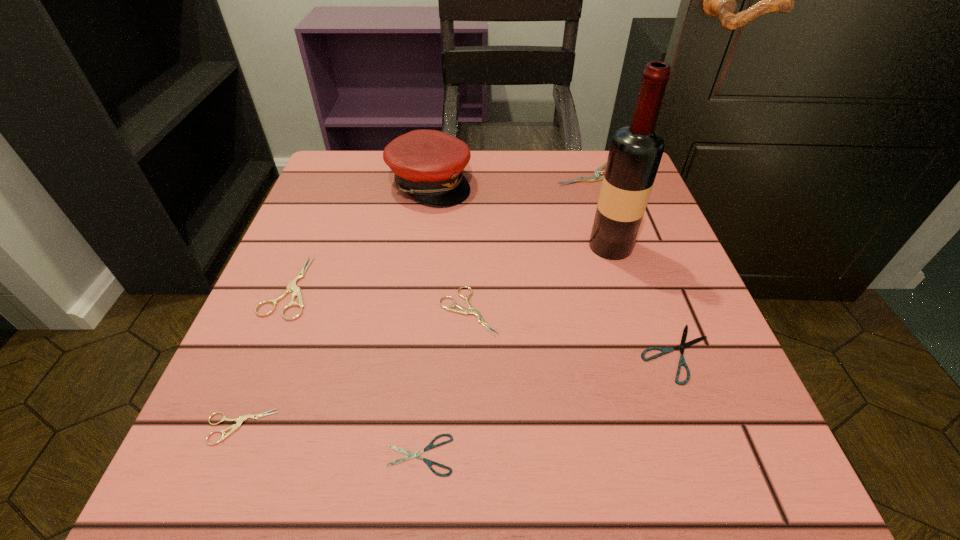
Locate an element on the screen. The width and height of the screenshot is (960, 540). the bigger black shears is located at coordinates (683, 345).

Locate an element on the screen. the farther black shears is located at coordinates (683, 345).

Identify the location of the nearer black shears. The height and width of the screenshot is (540, 960). (410, 454).

You are a GUI agent. You are given a task and a screenshot of the screen. Output one action in this format:
    pyautogui.click(x=<x>, y=<y>)
    Task: Click on the shortest object
    The height and width of the screenshot is (540, 960).
    Given the screenshot: What is the action you would take?
    pyautogui.click(x=410, y=454)

You are a GUI agent. You are given a task and a screenshot of the screen. Output one action in this format:
    pyautogui.click(x=<x>, y=<y>)
    Task: Click on the vacant space situated 0.310m on the back of the tallest object
    
    Given the screenshot: What is the action you would take?
    pyautogui.click(x=581, y=153)

In order to click on free space located on the front-facing side of the second tallest object in this screenshot , I will do `click(555, 184)`.

This screenshot has height=540, width=960. Find the location of `blank space located 0.090m on the front of the farthest shears`. blank space located 0.090m on the front of the farthest shears is located at coordinates (606, 210).

Locate an element on the screen. The width and height of the screenshot is (960, 540). free region located 0.380m on the back of the second biggest beige shears is located at coordinates (346, 154).

Locate an element on the screen. The width and height of the screenshot is (960, 540). vacant space located on the front of the second beige shears from right to left is located at coordinates (467, 407).

I want to click on blank space located on the right of the smallest beige shears, so click(x=475, y=427).